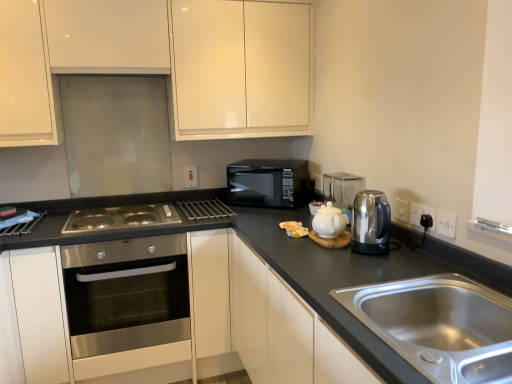
This screenshot has height=384, width=512. What are the coordinates of `vacant space positioned to the left of white glossy tea pot at center` in the screenshot? It's located at (286, 241).